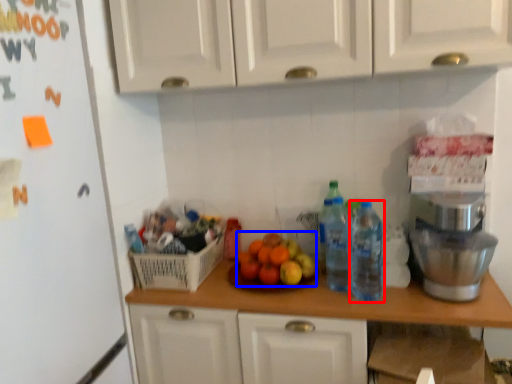
Question: Which point is further to the camera, kitchen appliance (highlighted by a red box) or fruit (highlighted by a blue box)?

Choices:
 (A) kitchen appliance
 (B) fruit

Answer: (B)